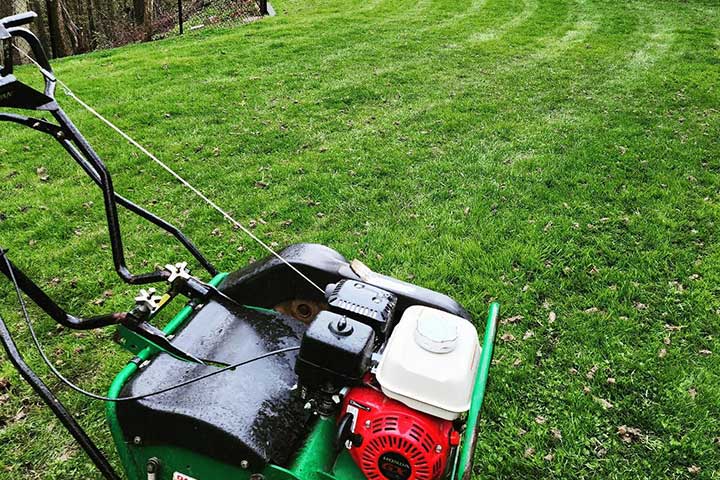
This screenshot has height=480, width=720. I want to click on exhaust vents, so click(x=408, y=450), click(x=391, y=444), click(x=369, y=467), click(x=389, y=426), click(x=374, y=426).